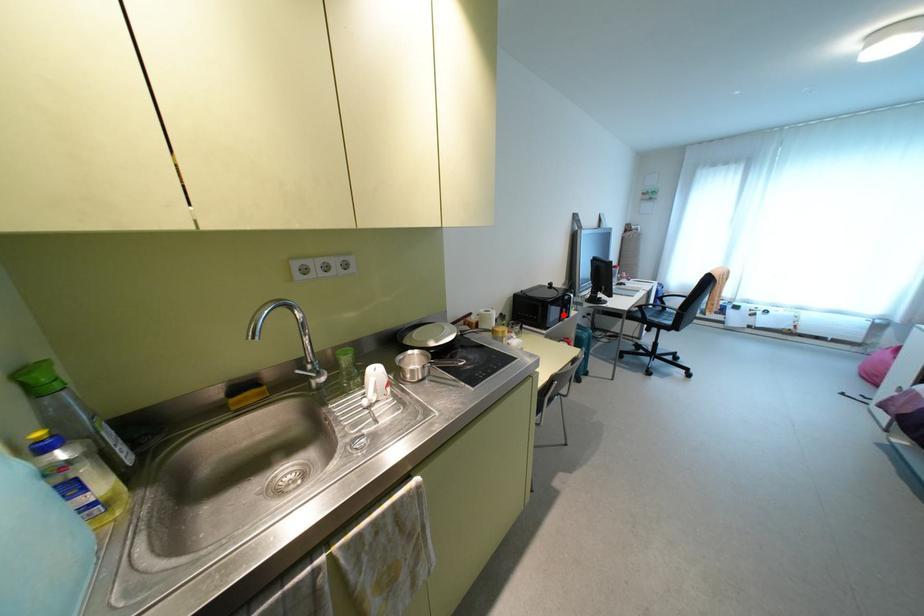
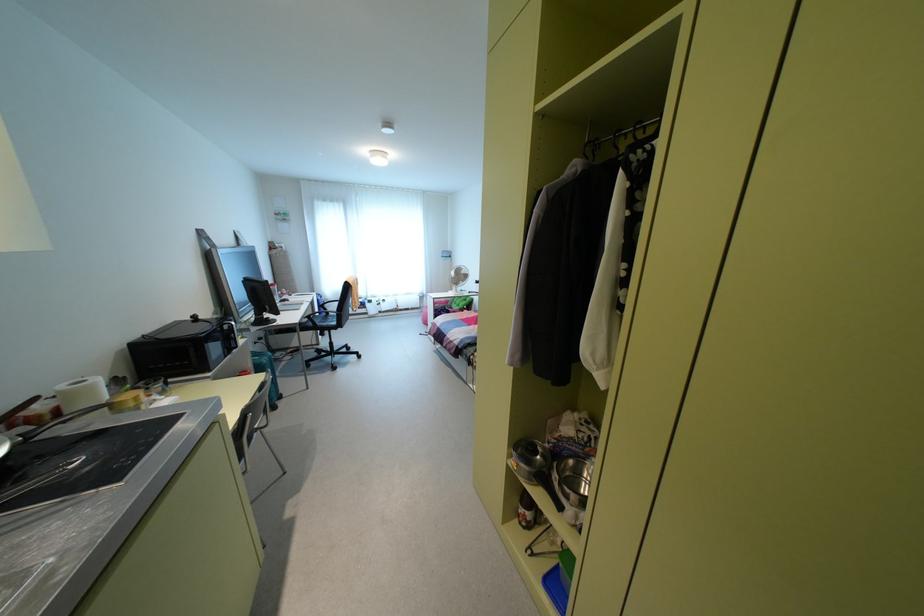
The point at the highlighted location is marked in the first image. Where is the corresponding point in the second image?

(229, 346)